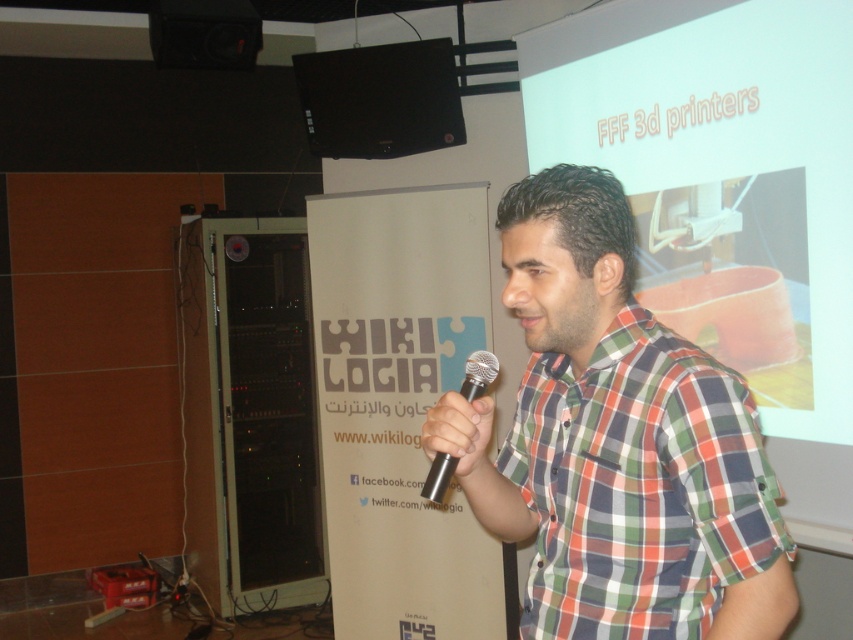
Question: Does plaid cotton shirt at center have a greater width compared to metallic silver microphone at center?

Choices:
 (A) yes
 (B) no

Answer: (A)

Question: Which object appears farthest from the camera in this image?

Choices:
 (A) matte white projector screen at upper center
 (B) black plastic speaker at upper left
 (C) black matte speaker at upper center
 (D) metallic silver microphone at center

Answer: (B)

Question: Which point is farther from the camera taking this photo?

Choices:
 (A) (477, 349)
 (B) (682, 36)

Answer: (B)

Question: Which point is farther from the camera taking this photo?

Choices:
 (A) (183, 22)
 (B) (843, 170)
 (C) (384, 104)

Answer: (A)

Question: Is matte white projector screen at upper center bigger than black matte speaker at upper center?

Choices:
 (A) no
 (B) yes

Answer: (B)

Question: Is plaid cotton shirt at center above black plastic speaker at upper left?

Choices:
 (A) yes
 (B) no

Answer: (B)